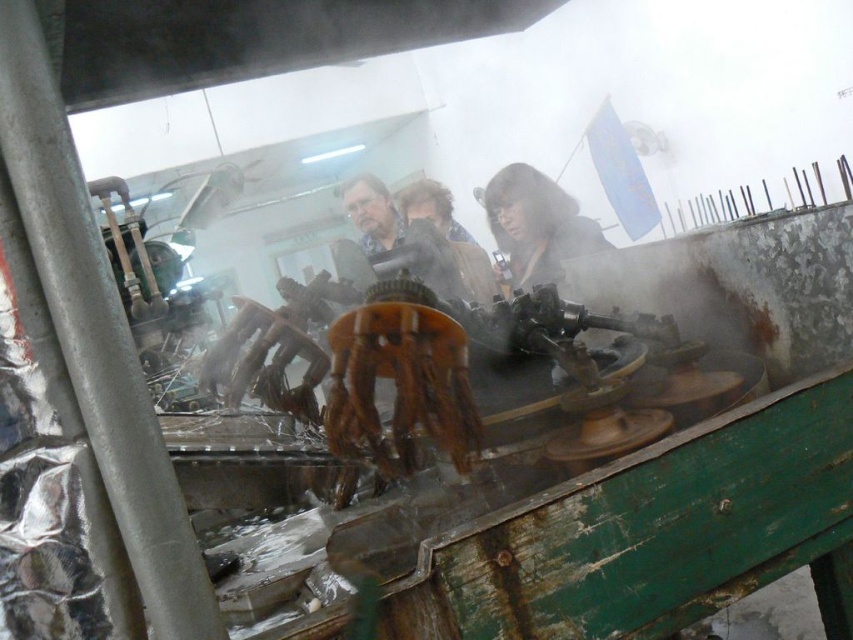
Image resolution: width=853 pixels, height=640 pixels. Find the location of `dark brown leather jacket at center`. dark brown leather jacket at center is located at coordinates (537, 225).

Does point (492, 193) come behind point (456, 230)?

No, (492, 193) is in front of (456, 230).

The image size is (853, 640). Describe the element at coordinates (537, 225) in the screenshot. I see `dark brown leather jacket at center` at that location.

Where is `dark brown leather jacket at center`? This screenshot has width=853, height=640. dark brown leather jacket at center is located at coordinates (537, 225).